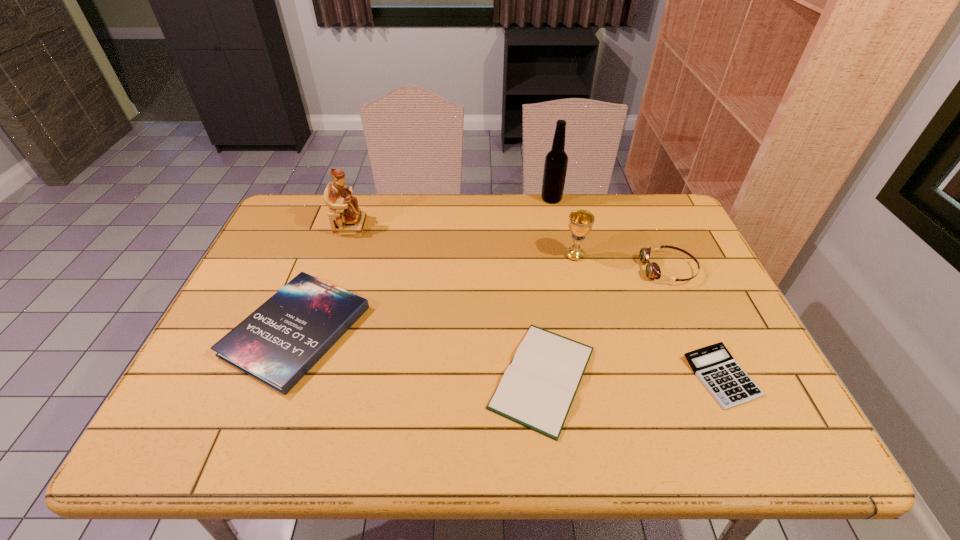
Locate an element on the screen. This screenshot has height=540, width=960. the farthest object is located at coordinates (555, 168).

Locate an element on the screen. Image resolution: width=960 pixels, height=540 pixels. the tallest object is located at coordinates (555, 168).

The image size is (960, 540). I want to click on the second farthest object, so click(346, 218).

Find the location of `the sixth shortest object`. the sixth shortest object is located at coordinates (346, 218).

You are a GUI agent. You are given a task and a screenshot of the screen. Output one action in this format:
    pyautogui.click(x=<x>, y=<y>)
    Task: Click on the third tallest object
    The height and width of the screenshot is (540, 960).
    Given the screenshot: What is the action you would take?
    pyautogui.click(x=580, y=224)

You are a GUI agent. You are given a task and a screenshot of the screen. Output one action in this format:
    pyautogui.click(x=<x>, y=<y>)
    Task: Click on the goggles
    This screenshot has height=540, width=960.
    Given the screenshot: What is the action you would take?
    pyautogui.click(x=652, y=270)

The image size is (960, 540). I want to click on the taller hardback book, so click(277, 344).

Where is `the third shortest object`? the third shortest object is located at coordinates (277, 344).

Locate an element on the screen. the right hardback book is located at coordinates (537, 390).

Image resolution: width=960 pixels, height=540 pixels. I want to click on the shortest object, so tap(728, 383).